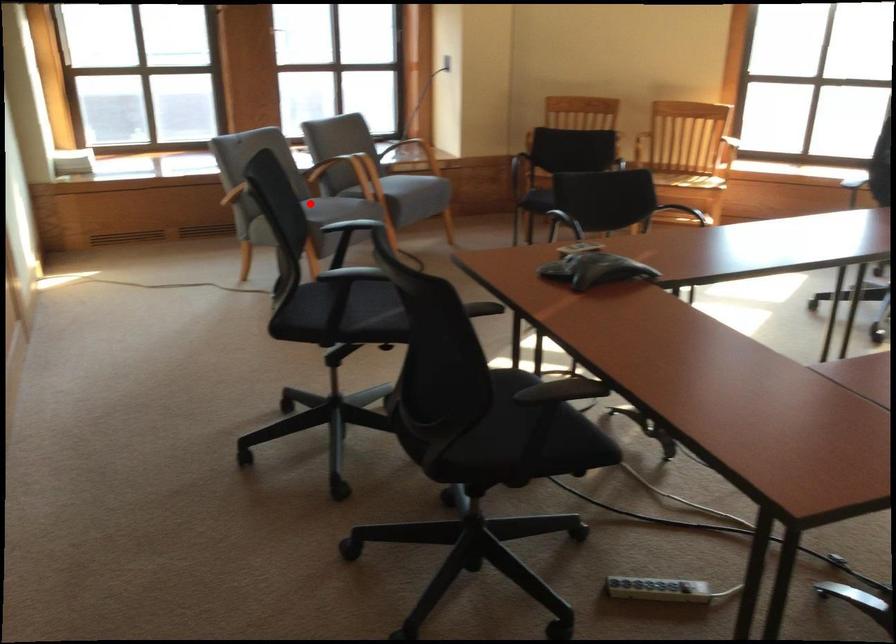
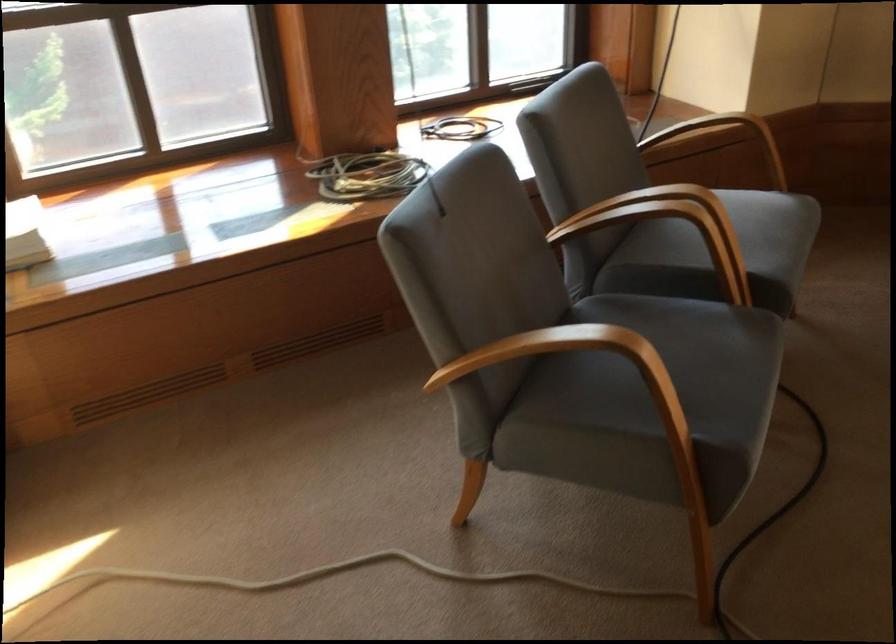
Question: A red point is marked in image1. In image2, is the corresponding 3D point closer to the camera or farther? Reply with the corresponding letter.

Choices:
 (A) The corresponding 3D point is closer.
 (B) The corresponding 3D point is farther.

Answer: (A)